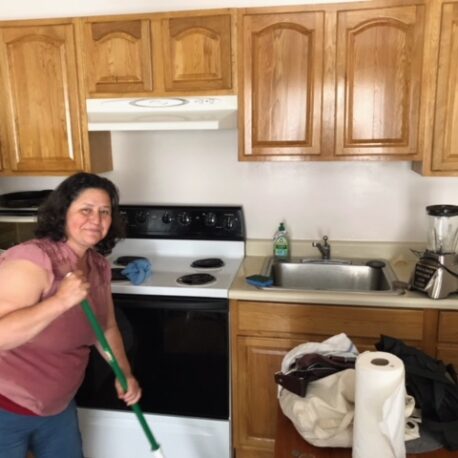
Image resolution: width=458 pixels, height=458 pixels. What are the coordinates of `dishwashing soap` in the screenshot? It's located at (278, 245).